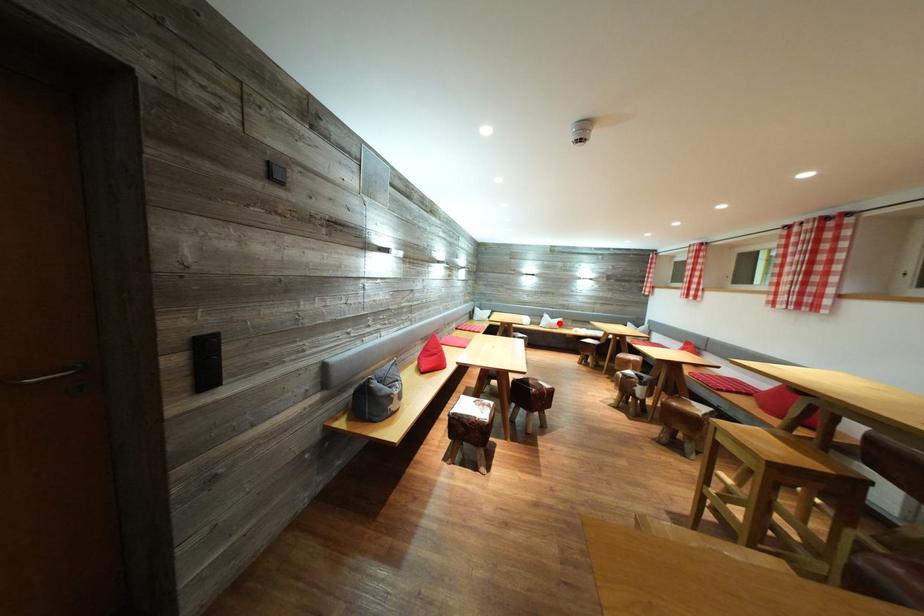
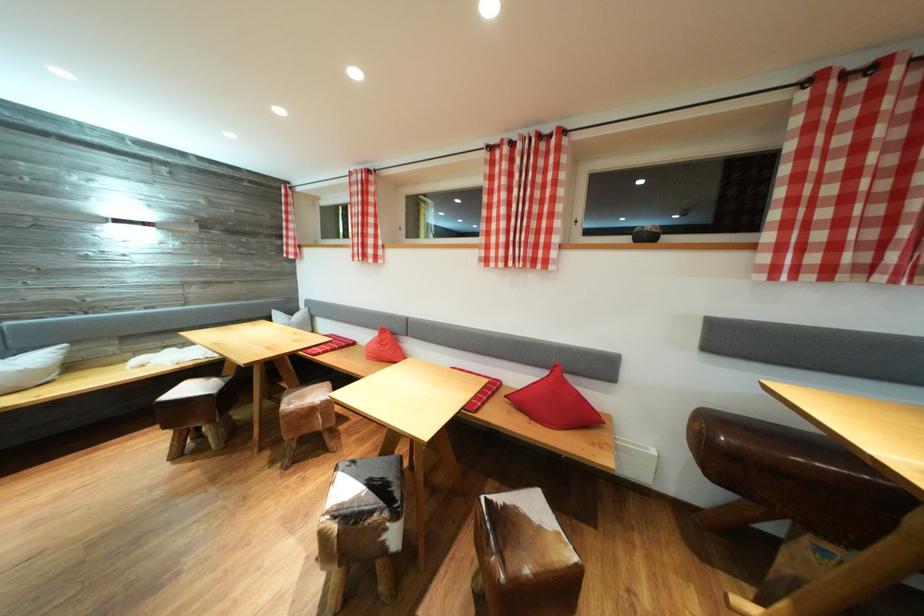
The point at the highlighted location is marked in the first image. Where is the corresponding point in the second image?

(14, 358)